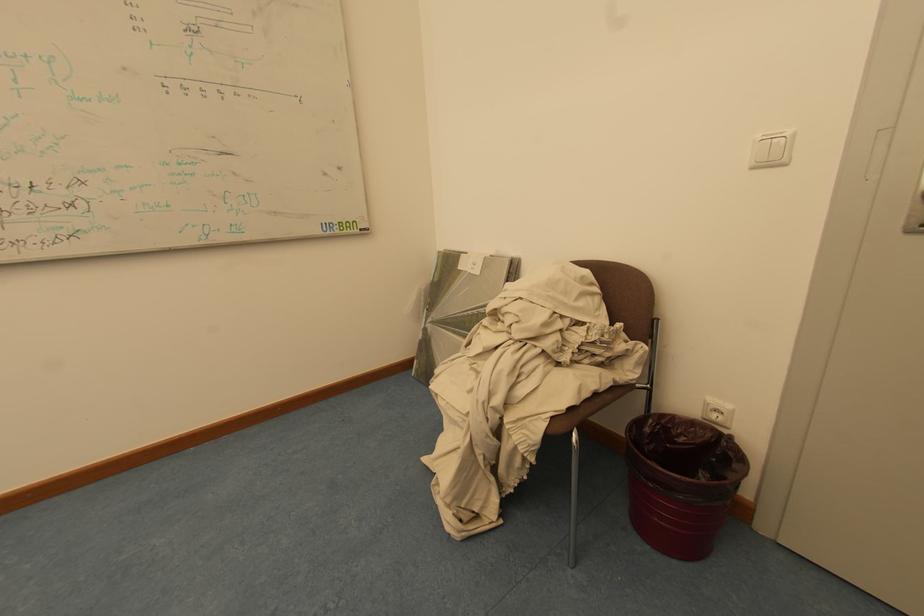
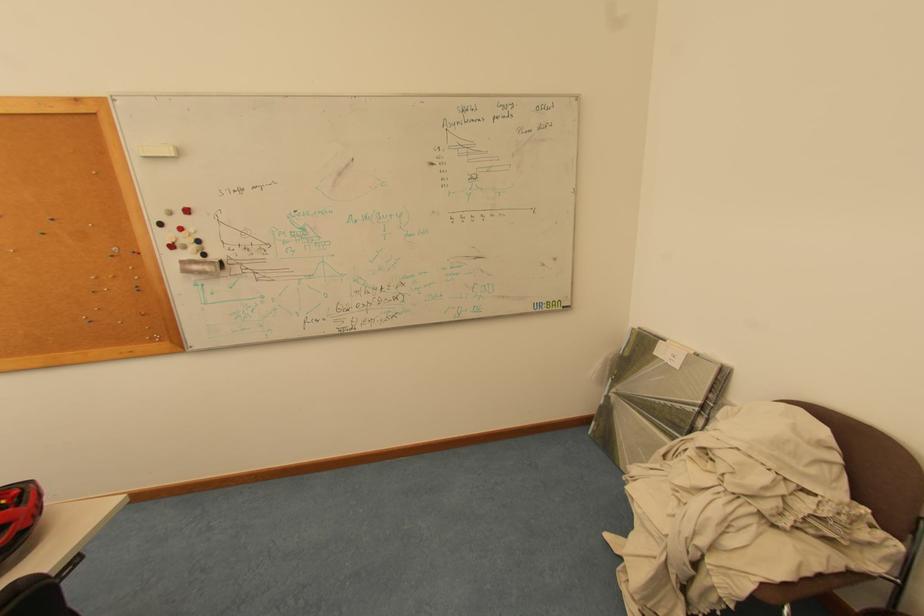
In the second image, find the point that corresponds to the point at 436,322 in the first image.

(622, 392)